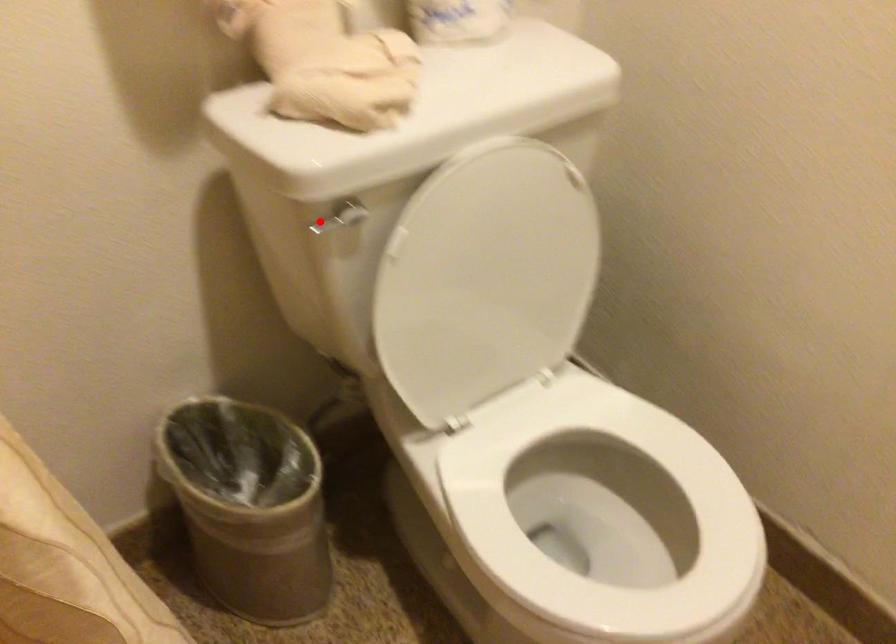
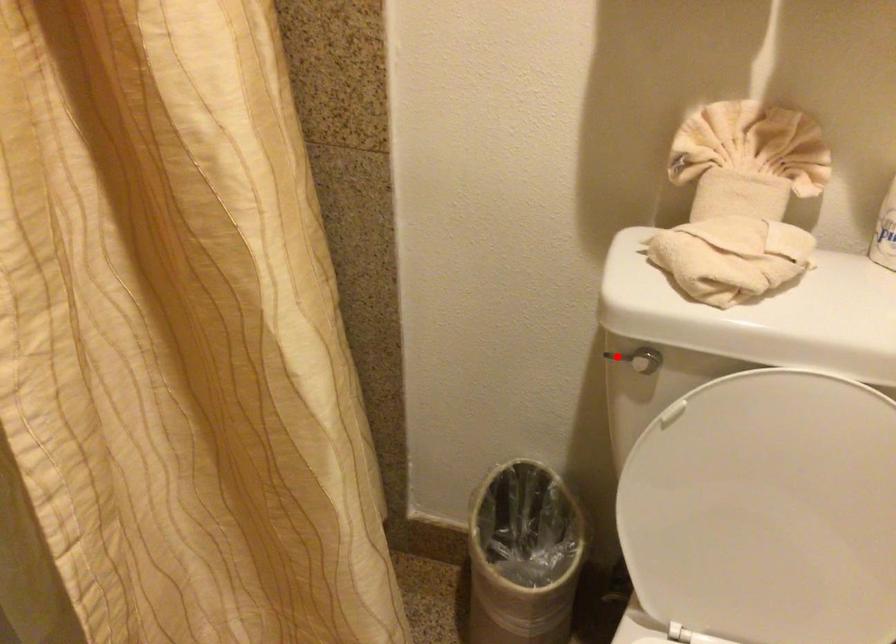
I am providing you with two images of the same scene from different viewpoints. A red point is marked on the first image and another point is marked on the second image. Do the highlighted points in image1 and image2 indicate the same real-world spot?

Yes